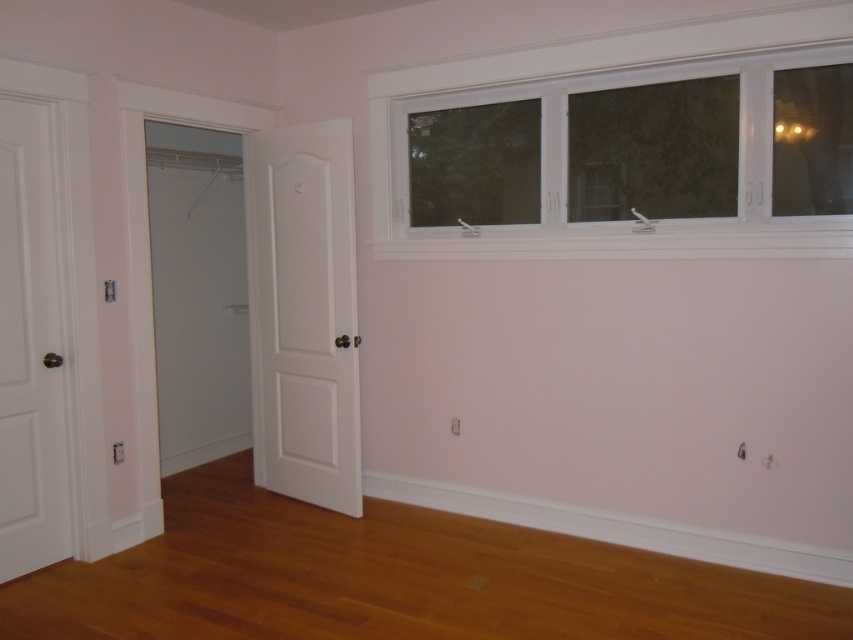
Can you confirm if white plastic window at upper right is positioned above white matte door at center?

Correct, white plastic window at upper right is located above white matte door at center.

Can you confirm if white plastic window at upper right is positioned to the left of white matte door at center?

In fact, white plastic window at upper right is to the right of white matte door at center.

Where is `white plastic window at upper right`? white plastic window at upper right is located at coordinates (566, 152).

Can you confirm if white matte door at center is positioned below white matte door at left?

No.

Between white matte door at center and white matte door at left, which one is positioned higher?

Positioned higher is white matte door at center.

Which is in front, point (343, 385) or point (18, 435)?

Point (18, 435) is more forward.

The width and height of the screenshot is (853, 640). I want to click on white matte door at center, so click(x=305, y=314).

From the picture: Is white plastic window at upper right below white matte door at left?

No, white plastic window at upper right is not below white matte door at left.

Identify the location of white plastic window at upper right. This screenshot has width=853, height=640. (566, 152).

Who is more distant from viewer, (824,246) or (44,284)?

Positioned behind is point (44,284).

Find the location of a particular element. The height and width of the screenshot is (640, 853). white plastic window at upper right is located at coordinates (566, 152).